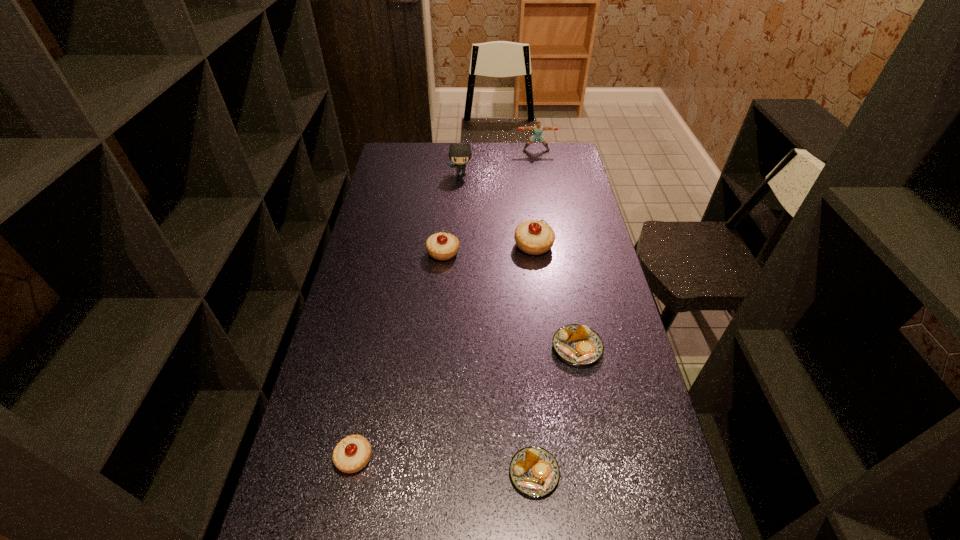
At what (x,y) coordinates should I click in order to perform the action: click on vacant space situated on the left of the shortest object. Please return your answer as a coordinate pair (x, y). Looking at the image, I should click on (421, 474).

Where is `puncher that is positioned at the far edge`? The image size is (960, 540). puncher that is positioned at the far edge is located at coordinates (537, 129).

The width and height of the screenshot is (960, 540). What are the coordinates of `kitten present at the far edge` in the screenshot? It's located at (460, 154).

What are the coordinates of `object located in the left edge section of the desktop` in the screenshot? It's located at (351, 454).

At what (x,y) coordinates should I click in order to perform the action: click on puncher situated at the right edge. Please return your answer as a coordinate pair (x, y). This screenshot has height=540, width=960. Looking at the image, I should click on (537, 129).

At what (x,y) coordinates should I click in order to perform the action: click on pastry that is at the right edge. Please return your answer as a coordinate pair (x, y). This screenshot has width=960, height=540. Looking at the image, I should click on (579, 345).

You are a GUI agent. You are given a task and a screenshot of the screen. Output one action in this format:
    pyautogui.click(x=<x>, y=<y>)
    Task: Click on the object located in the far right corner section of the desktop
    This screenshot has height=540, width=960.
    Given the screenshot: What is the action you would take?
    pyautogui.click(x=537, y=129)

The height and width of the screenshot is (540, 960). I want to click on free space at the far edge of the desktop, so click(526, 152).

Where is `blank space at the left edge`? blank space at the left edge is located at coordinates pyautogui.click(x=336, y=369).

I want to click on vacant area at the right edge, so 610,403.